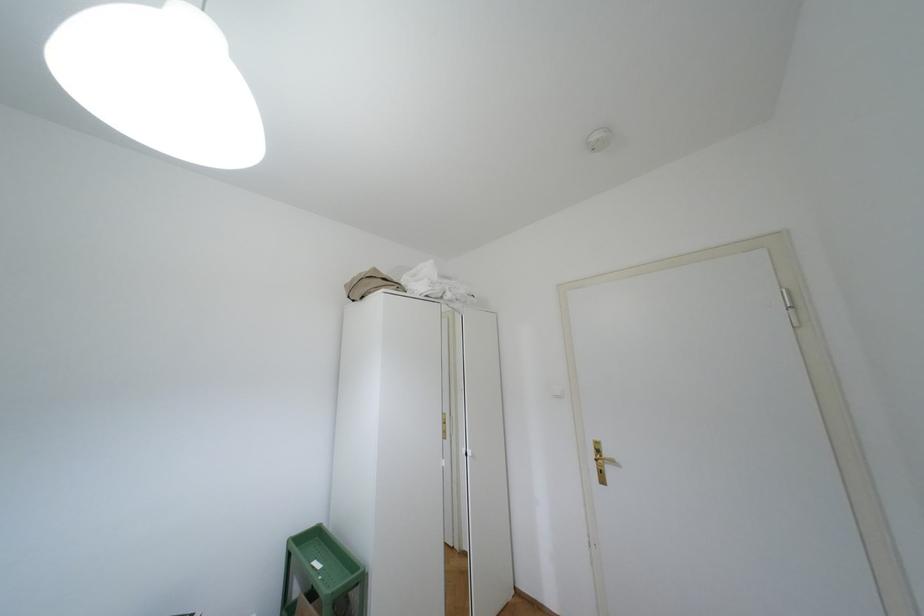
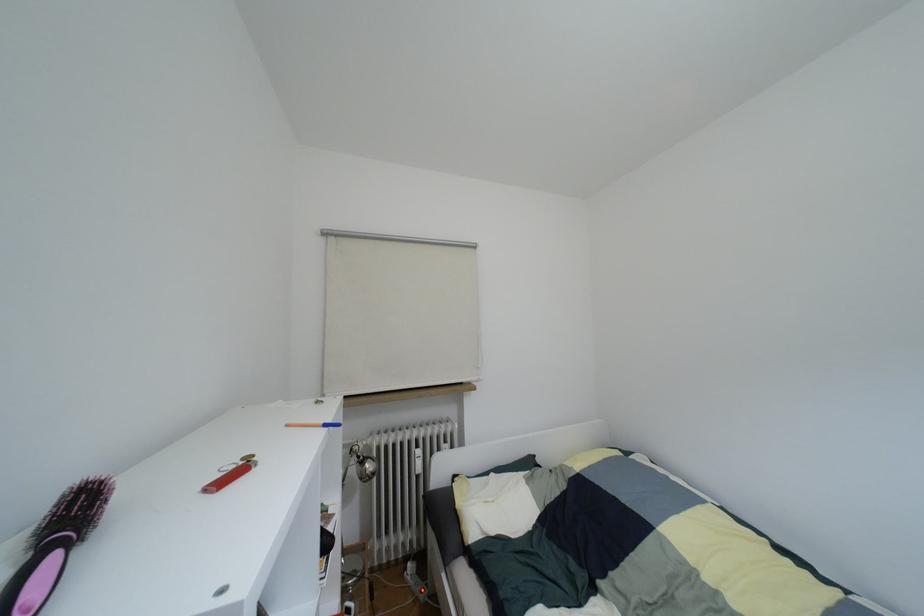
Question: The camera is either moving clockwise (left) or counter-clockwise (right) around the object. The first image is from the beginning of the video and the second image is from the end. Is the camera moving left or right when shooting the video?

Choices:
 (A) Left
 (B) Right

Answer: (B)